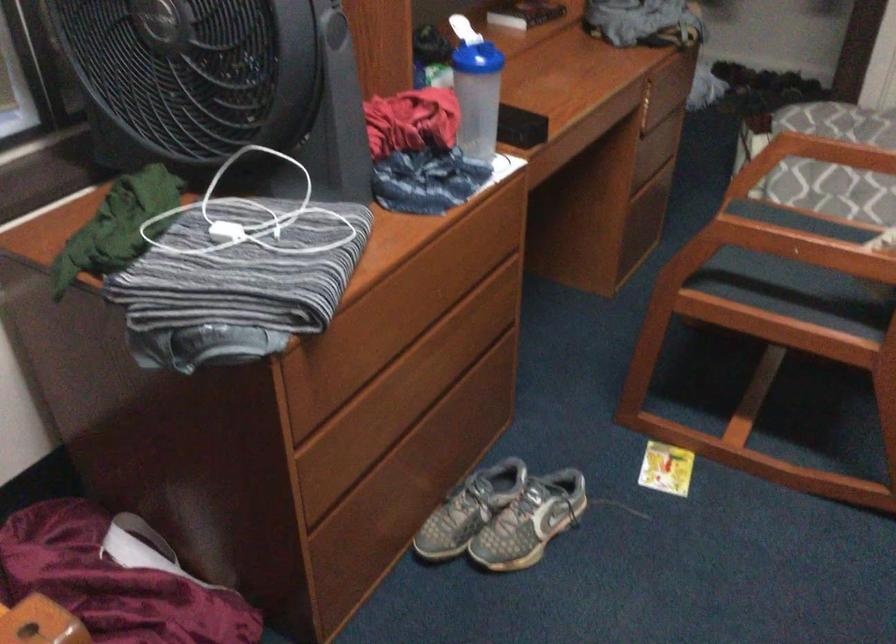
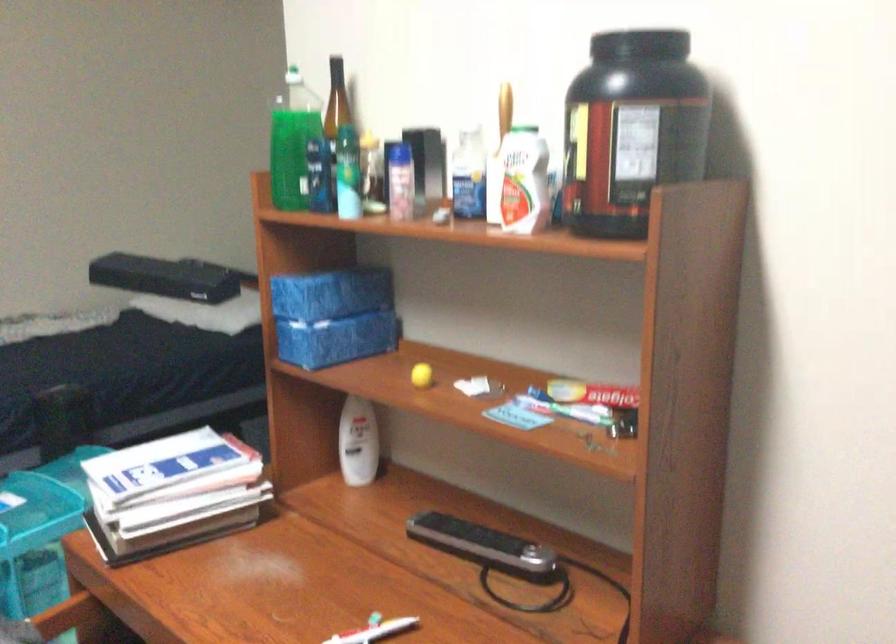
Question: The camera is either moving clockwise (left) or counter-clockwise (right) around the object. The first image is from the beginning of the video and the second image is from the end. Is the camera moving left or right when shooting the video?

Choices:
 (A) Left
 (B) Right

Answer: (A)